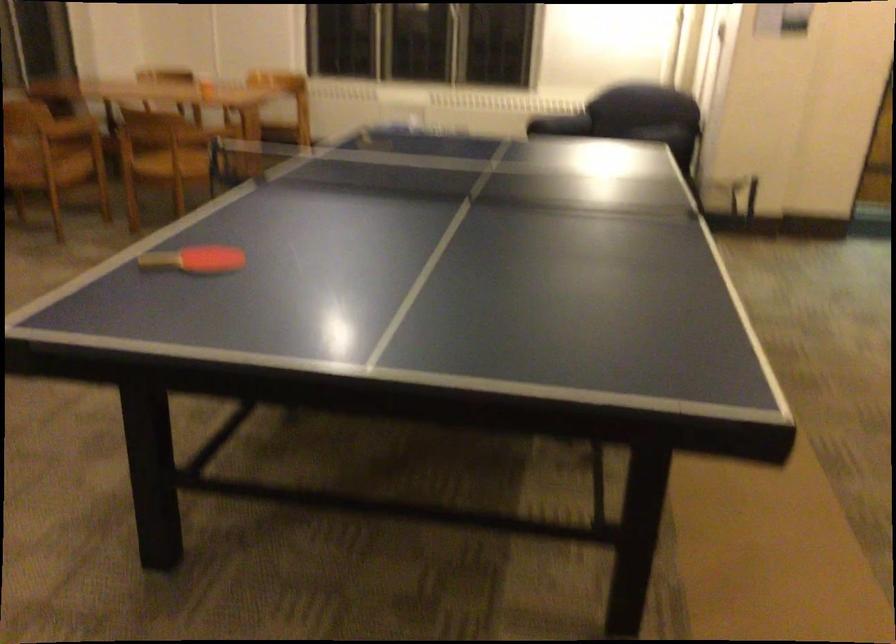
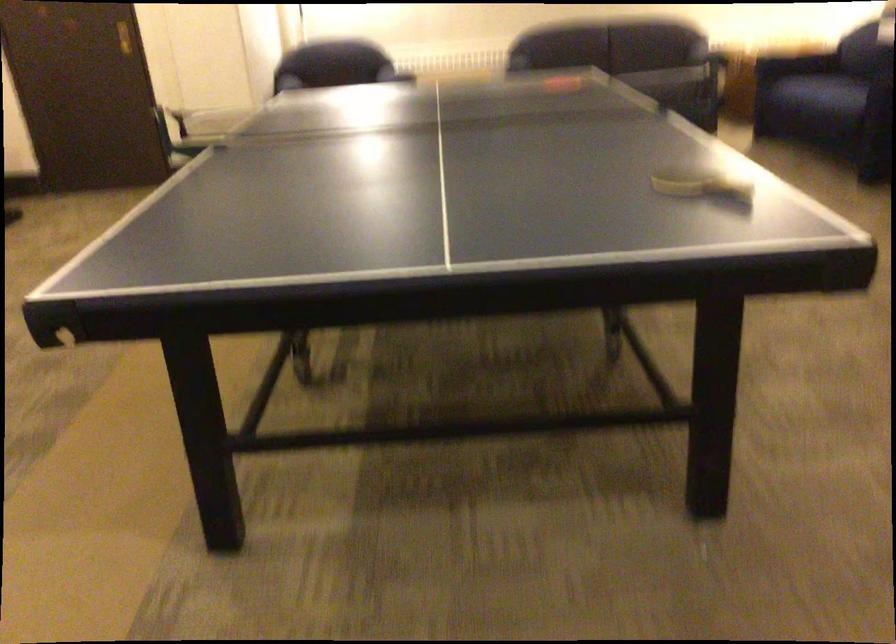
Question: I am providing you with two images of the same scene from different viewpoints. Please identify which objects are invisible in image2.

Choices:
 (A) ping-pong paddle
 (B) rack wheel
 (C) red ping-pong paddle
 (D) sofa sitting surface

Answer: (C)